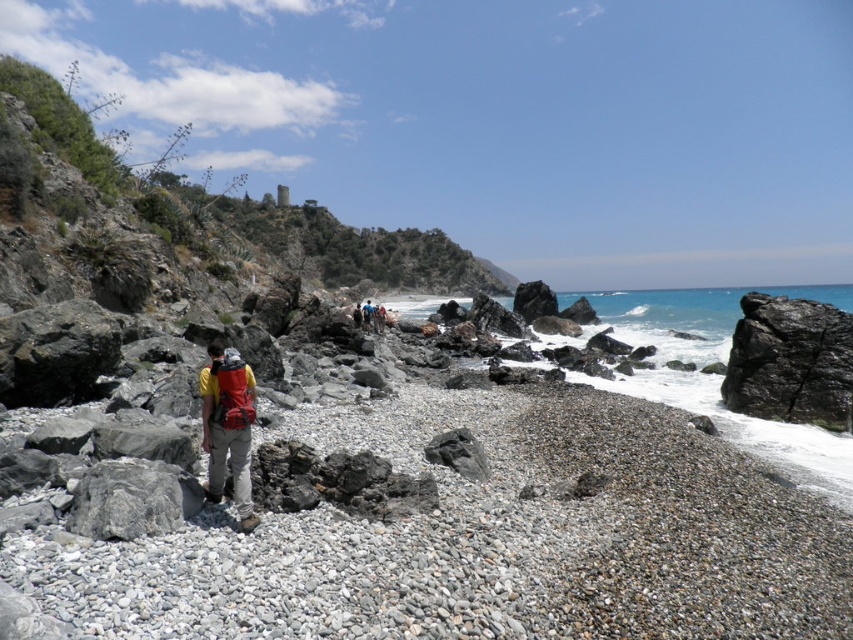
Question: Which of the following is the farthest from the observer?

Choices:
 (A) (219, 417)
 (B) (798, 397)
 (C) (99, 461)

Answer: (B)

Question: Does black rough rock at right have a smaller size compared to matte red backpack at center?

Choices:
 (A) no
 (B) yes

Answer: (A)

Question: Considering the real-world distances, which object is farthest from the gray rough rock at lower left?

Choices:
 (A) matte red backpack at center
 (B) black rough rock at right

Answer: (B)

Question: Considering the relative positions of gray rough rock at lower left and matte red backpack at center in the image provided, where is gray rough rock at lower left located with respect to matte red backpack at center?

Choices:
 (A) above
 (B) below

Answer: (B)

Question: Among these points, which one is farthest from the camera?

Choices:
 (A) (250, 422)
 (B) (178, 481)

Answer: (A)

Question: Considering the relative positions of gray rough rock at lower left and matte red backpack at center in the image provided, where is gray rough rock at lower left located with respect to matte red backpack at center?

Choices:
 (A) right
 (B) left

Answer: (B)